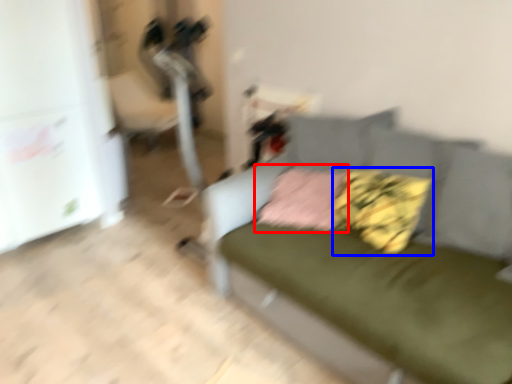
Question: Which object appears farthest to the camera in this image, pillow (highlighted by a red box) or pillow (highlighted by a blue box)?

Choices:
 (A) pillow
 (B) pillow

Answer: (A)